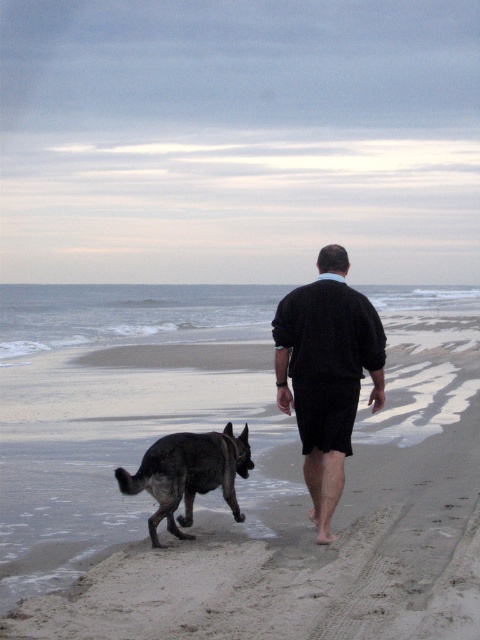
You are standing on the sandy beach at center and want to see the dark brown fur dog at lower left. Which direction should you look to see the dog?

The dark brown fur dog at lower left is located at a lower position than the sandy beach at center, so you should look downward to see the dog.

You are a photographer trying to capture the scene of the man and his dog on the beach. You notice the dark blue sweater at center and the dark brown fur dog at lower left. Which object should you focus on first if you want to include both in a single frame without cropping either?

The dark blue sweater at center is taller than the dark brown fur dog at lower left, so you should focus on the dark blue sweater at center first to ensure it fits within the frame since it is taller.